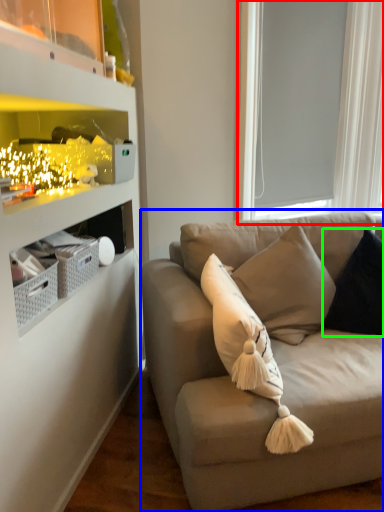
Question: Which is nearer to the window screen (highlighted by a red box)? studio couch (highlighted by a blue box) or pillow (highlighted by a green box).

Choices:
 (A) studio couch
 (B) pillow

Answer: (B)